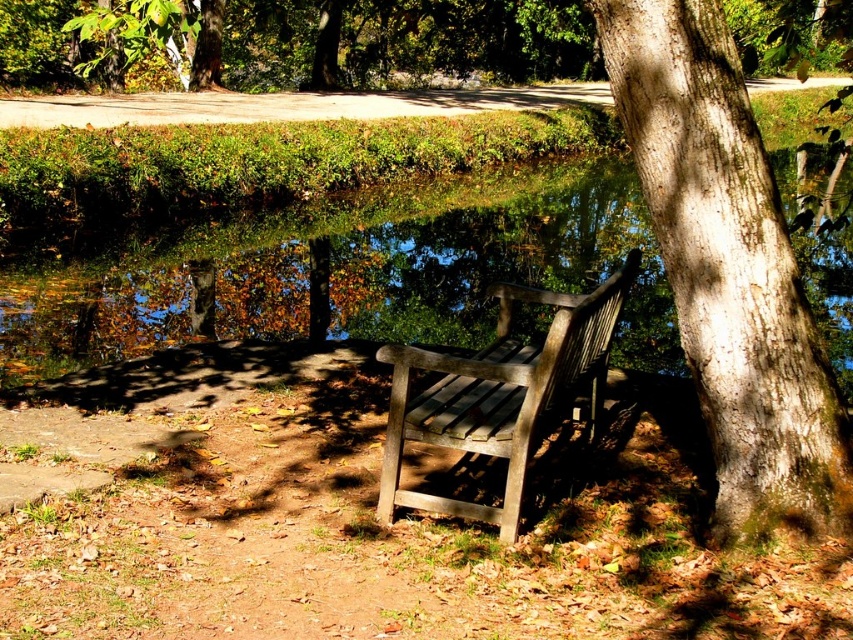
From the picture: Does green reflective water at center have a lesser height compared to wooden park bench at center?

Incorrect, green reflective water at center's height does not fall short of wooden park bench at center's.

Find the location of a particular element. This screenshot has width=853, height=640. green reflective water at center is located at coordinates (344, 276).

Locate an element on the screen. The image size is (853, 640). green reflective water at center is located at coordinates (344, 276).

Can you confirm if green reflective water at center is positioned to the right of smooth bark tree at center?

Yes, green reflective water at center is to the right of smooth bark tree at center.

Consider the image. Which of these two, green reflective water at center or smooth bark tree at center, stands taller?

green reflective water at center is taller.

Does point (289, 314) lie behind point (750, 488)?

Yes, it is.

Where is `green reflective water at center`? Image resolution: width=853 pixels, height=640 pixels. green reflective water at center is located at coordinates pyautogui.click(x=344, y=276).

Does smooth bark tree at center have a larger size compared to wooden park bench at center?

No.

Is point (788, 253) positioned after point (595, 298)?

No.

Identify the location of smooth bark tree at center. (728, 268).